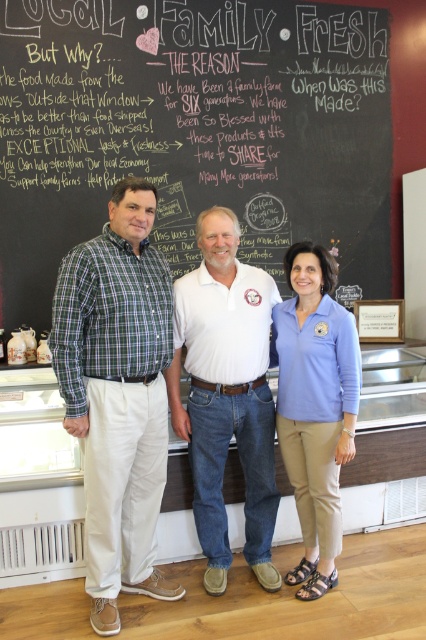
Question: Is the position of green plaid shirt at left more distant than that of white cotton shirt at center?

Choices:
 (A) yes
 (B) no

Answer: (B)

Question: Does chalkboard at center lie in front of white cotton shirt at center?

Choices:
 (A) no
 (B) yes

Answer: (A)

Question: Is chalkboard at center bigger than white cotton shirt at center?

Choices:
 (A) yes
 (B) no

Answer: (A)

Question: Which point is closer to the camera taking this photo?

Choices:
 (A) (294, 445)
 (B) (77, 406)
 (C) (69, 54)

Answer: (B)

Question: Which object is positioned farthest from the green plaid shirt at left?

Choices:
 (A) blue cotton shirt at center
 (B) matte blue shirt at center
 (C) white cotton shirt at center

Answer: (B)

Question: Which is farther from the chalkboard at center?

Choices:
 (A) green plaid shirt at left
 (B) blue cotton shirt at center
 (C) white cotton shirt at center

Answer: (A)